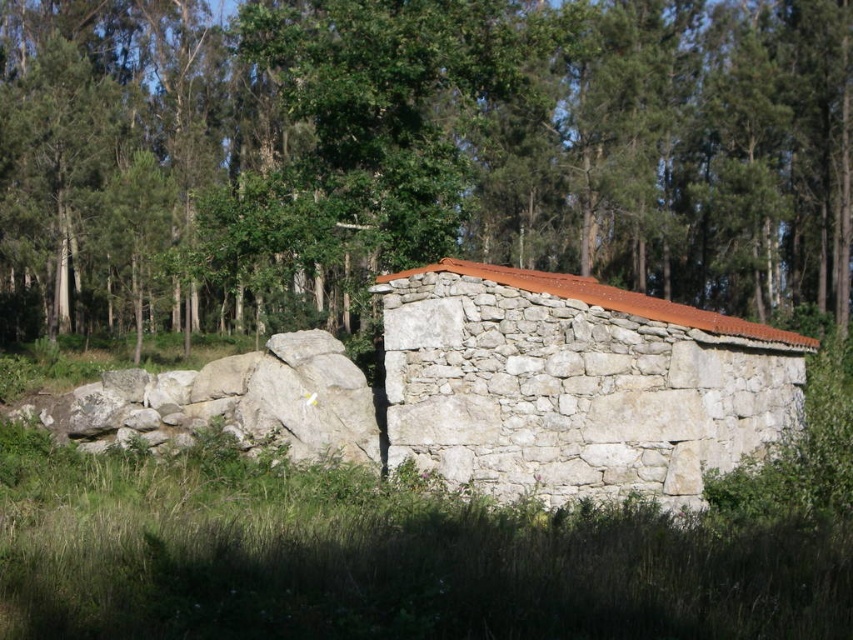
Does green leafy tree at center come in front of green grass at lower center?

No, it is not.

Who is taller, green leafy tree at center or green grass at lower center?

green leafy tree at center

Identify the location of green leafy tree at center. Image resolution: width=853 pixels, height=640 pixels. (416, 154).

Does green grass at lower center have a greater height compared to white stone hut at center?

Yes.

Which is more to the left, green grass at lower center or white stone hut at center?

From the viewer's perspective, green grass at lower center appears more on the left side.

Who is more forward, (698,541) or (670,356)?

Point (698,541)

Find the location of a particular element. green grass at lower center is located at coordinates (381, 560).

Is point (225, 141) farther from camera compared to point (670, 465)?

Yes, point (225, 141) is farther from viewer.

Does green leafy tree at center have a greater width compared to white stone hut at center?

Correct, the width of green leafy tree at center exceeds that of white stone hut at center.

The height and width of the screenshot is (640, 853). Describe the element at coordinates (416, 154) in the screenshot. I see `green leafy tree at center` at that location.

Identify the location of green leafy tree at center. The image size is (853, 640). (416, 154).